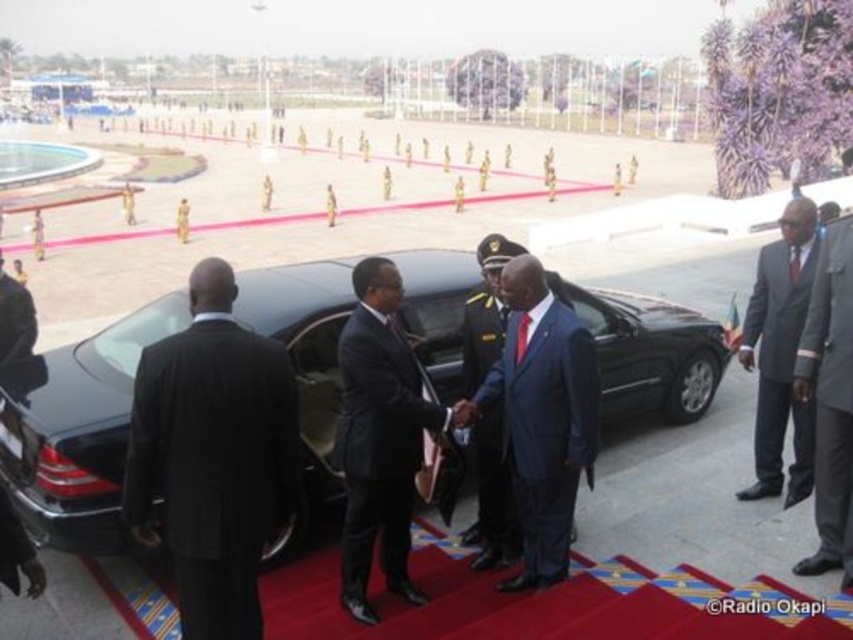
You are a photographer at the event and need to capture a photo of both the blue glossy suit at center and the dark blue satin suit at center. Given that your camera has a minimum focus distance of 60 centimeters, will you be able to focus on both subjects simultaneously?

The blue glossy suit at center is 60.28 centimeters away from the dark blue satin suit at center. Since the distance between them is just over 60 centimeters, your camera can focus on both subjects as the separation meets the minimum focus requirement.

You are attending this event and need to identify the person in the blue glossy suit at center. Where relative to the person in the dark blue suit at center should you look?

The blue glossy suit at center is positioned on the right side of dark blue suit at center, so you should look to the right of the person in the dark blue suit at center to find the person in the blue glossy suit at center.